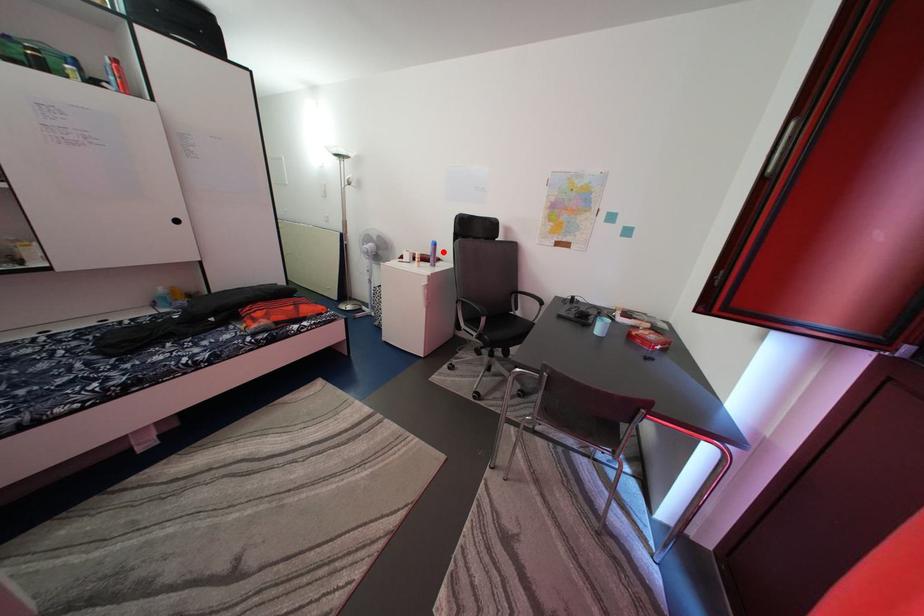
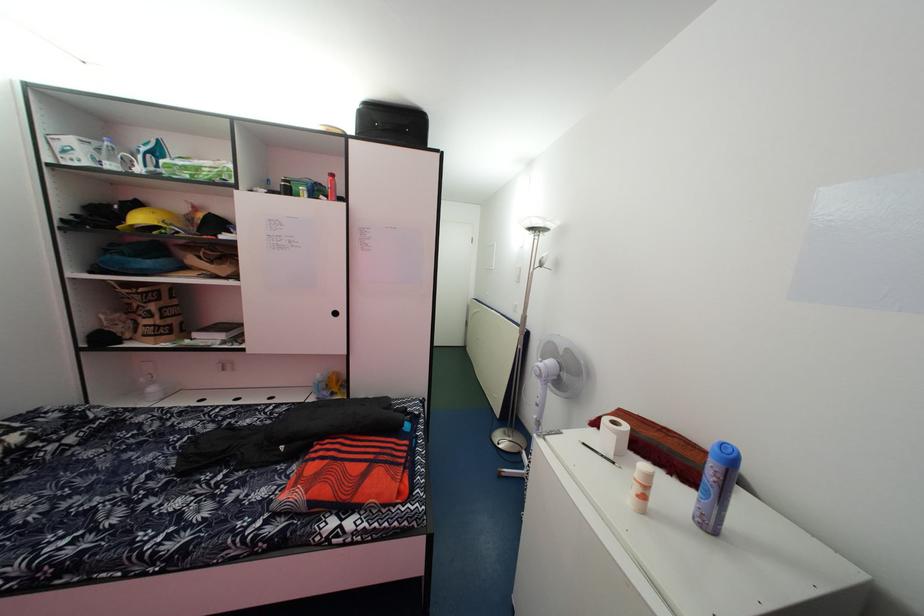
Where in the second image is the point corresponding to the highlighted location from the first image?

(738, 466)